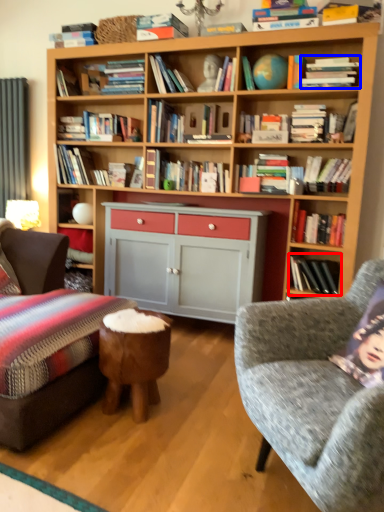
Question: Which point is closer to the camera, book (highlighted by a red box) or magazine (highlighted by a blue box)?

Choices:
 (A) book
 (B) magazine

Answer: (B)